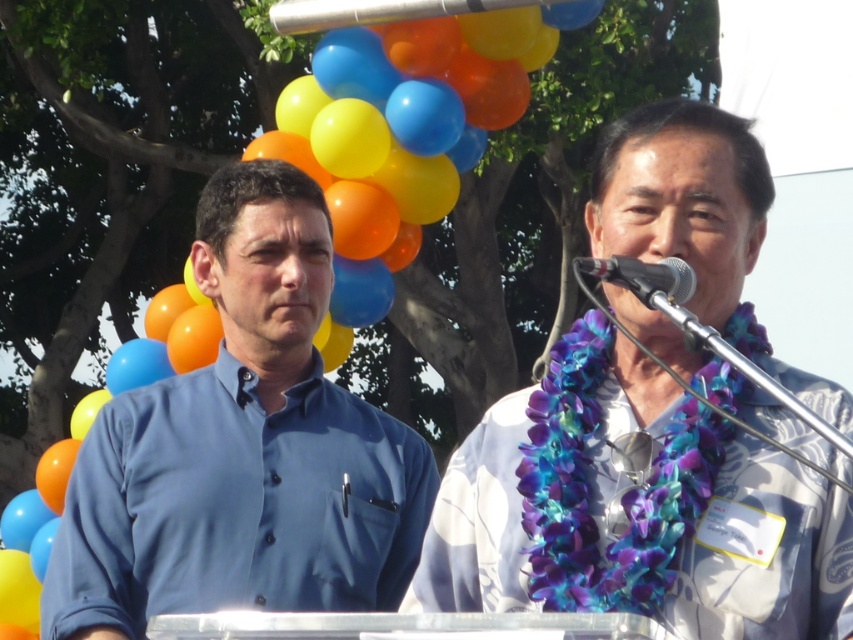
You are a photographer at the event and want to capture a photo where the blue floral lei at center is clearly visible above the metallic silver microphone at upper center. Is this possible given their current positions?

The blue floral lei at center is positioned under the metallic silver microphone at upper center, so it cannot be seen above it in the current arrangement.

You are a photographer at the event and want to capture a clear photo of the blue floral lei at center without the matte blue shirt at center appearing in the foreground. Is this possible based on their current positions?

The blue floral lei at center is in front of the matte blue shirt at center, so taking a photo from this angle would still show the matte blue shirt at center behind the lei, making it visible in the background. To avoid the shirt, you might need to adjust your position or angle to frame the lei separately.